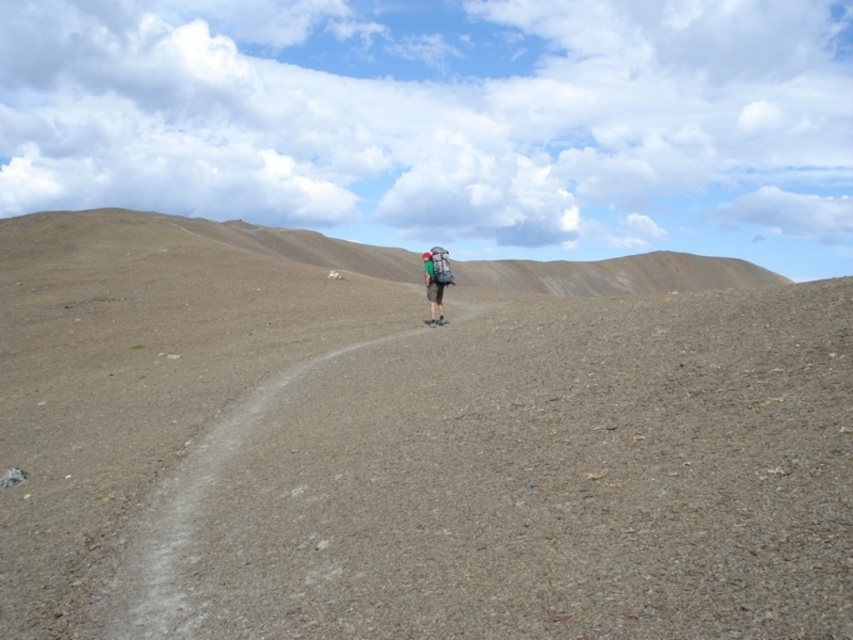
Based on the photo, who is lower down, brown gravel path at center or green fabric backpack at center?

brown gravel path at center is below.

Between point (30, 492) and point (428, 301), which one is positioned behind?

The point (428, 301) is behind.

The image size is (853, 640). Describe the element at coordinates (453, 472) in the screenshot. I see `brown gravel path at center` at that location.

At what (x,y) coordinates should I click in order to perform the action: click on brown gravel path at center. Please return your answer as a coordinate pair (x, y). Looking at the image, I should click on (453, 472).